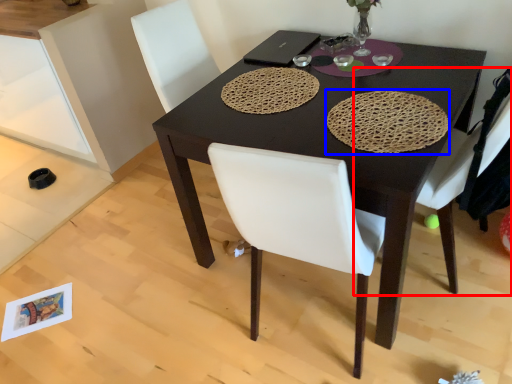
Question: Which object is closer to the camera taking this photo, chair (highlighted by a red box) or mat (highlighted by a blue box)?

Choices:
 (A) chair
 (B) mat

Answer: (A)